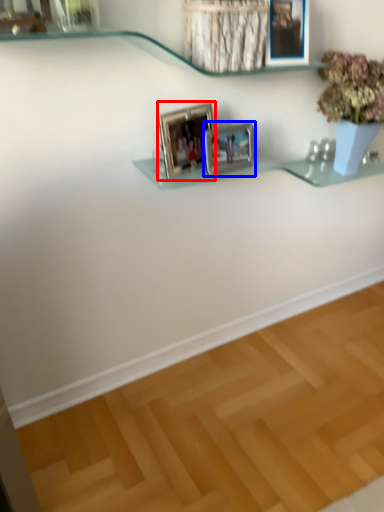
Question: Which of the following is the farthest to the observer, picture frame (highlighted by a red box) or picture frame (highlighted by a blue box)?

Choices:
 (A) picture frame
 (B) picture frame

Answer: (B)